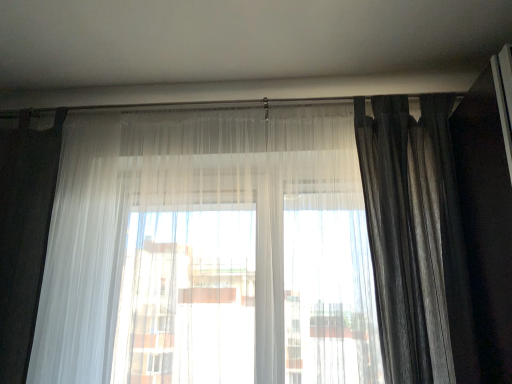
Question: Do you think dark gray textured curtain at right, which ranks as the first curtain in right-to-left order, is within sheer white curtain at center, which ranks as the 2th curtain in right-to-left order, or outside of it?

Choices:
 (A) inside
 (B) outside

Answer: (B)

Question: From the image's perspective, relative to sheer white curtain at center, which ranks as the 2th curtain in right-to-left order, is dark gray textured curtain at right, the 2th curtain positioned from the left, above or below?

Choices:
 (A) below
 (B) above

Answer: (B)

Question: In terms of size, does dark gray textured curtain at right, which ranks as the first curtain in right-to-left order, appear bigger or smaller than sheer white curtain at center, which ranks as the 2th curtain in right-to-left order?

Choices:
 (A) small
 (B) big

Answer: (A)

Question: Looking at their shapes, would you say sheer white curtain at center, which ranks as the 2th curtain in right-to-left order, is wider or thinner than dark gray textured curtain at right, which ranks as the first curtain in right-to-left order?

Choices:
 (A) thin
 (B) wide

Answer: (A)

Question: Is point (198, 160) closer or farther from the camera than point (397, 119)?

Choices:
 (A) closer
 (B) farther

Answer: (B)

Question: In the image, is sheer white curtain at center, which appears as the first curtain when viewed from the left, positioned in front of or behind dark gray textured curtain at right, which ranks as the first curtain in right-to-left order?

Choices:
 (A) behind
 (B) front

Answer: (B)

Question: In the image, is sheer white curtain at center, which ranks as the 2th curtain in right-to-left order, on the left side or the right side of dark gray textured curtain at right, which ranks as the first curtain in right-to-left order?

Choices:
 (A) right
 (B) left

Answer: (B)